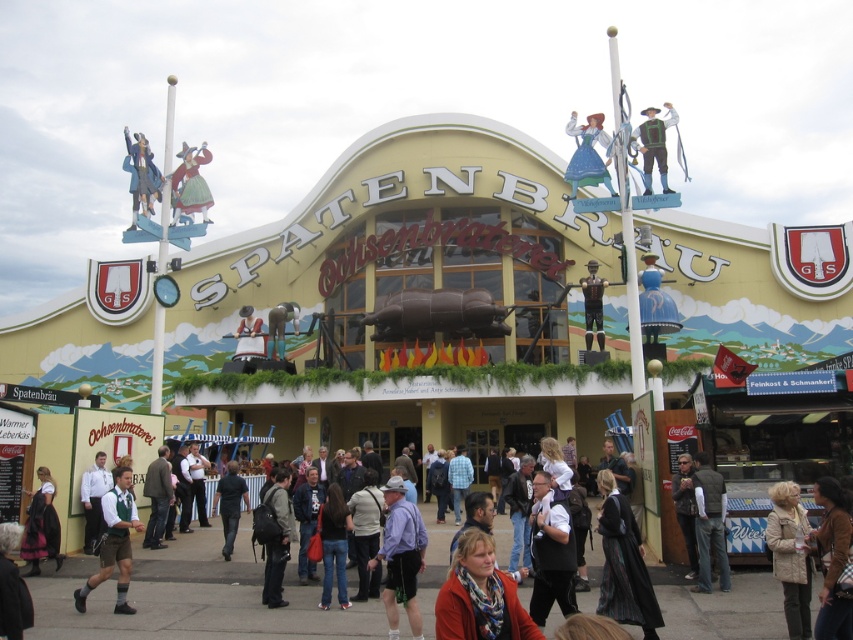
Who is more distant from viewer, (x=642, y=627) or (x=103, y=573)?

Positioned behind is point (x=103, y=573).

Measure the distance from black wool coat at center to green plaid shirt at center.

black wool coat at center and green plaid shirt at center are 125.31 feet apart from each other.

Does point (637, 534) lie in front of point (134, 513)?

Yes, point (637, 534) is closer to viewer.

At what (x,y) coordinates should I click in order to perform the action: click on black wool coat at center. Please return your answer as a coordinate pair (x, y). Looking at the image, I should click on (624, 564).

Between dark gray backpack at center and green fabric shirt at center, which one appears on the right side from the viewer's perspective?

dark gray backpack at center

Is dark gray backpack at center positioned behind green fabric shirt at center?

That is False.

Is point (288, 477) positioned before point (152, 486)?

That is True.

This screenshot has height=640, width=853. Find the location of `dark gray backpack at center`. dark gray backpack at center is located at coordinates (277, 540).

Is matte blue shirt at center smaller than wooden figure at center?

Actually, matte blue shirt at center might be larger than wooden figure at center.

Between point (403, 556) and point (262, 355), which one is positioned behind?

The point (262, 355) is more distant.

Locate an element on the screen. This screenshot has width=853, height=640. matte blue shirt at center is located at coordinates (399, 556).